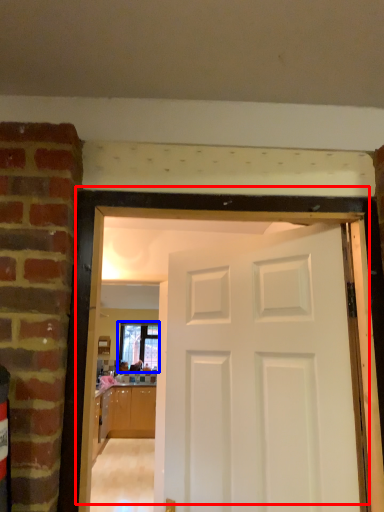
Question: Which of the following is the farthest to the observer, door (highlighted by a red box) or window (highlighted by a blue box)?

Choices:
 (A) door
 (B) window

Answer: (B)